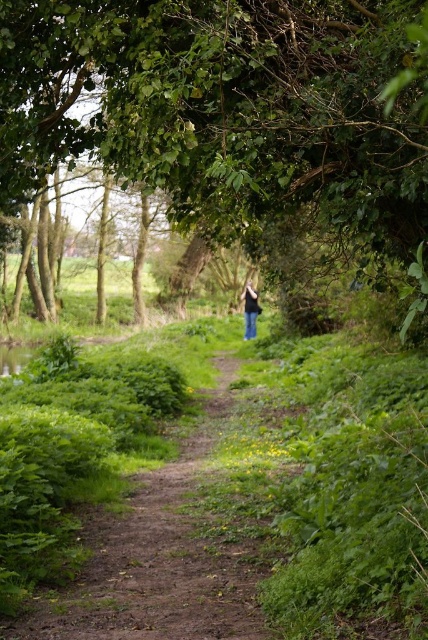
You are a hiker planning to walk along the dirt path at center. There is a green leafy tree at center nearby. Considering their sizes, which one occupies more space in the scene?

The green leafy tree at center has a larger size compared to the dirt path at center, so it occupies more space in the scene.

You are a hiker trying to navigate the dirt path at center. There is a green leafy tree at center blocking your way. Can you walk under the tree without ducking?

The green leafy tree at center is much taller than the dirt path at center, so you can walk under it without needing to duck.